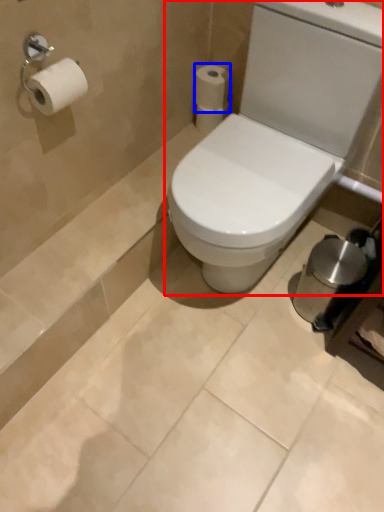
Question: Which object is further to the camera taking this photo, toilet (highlighted by a red box) or toilet paper (highlighted by a blue box)?

Choices:
 (A) toilet
 (B) toilet paper

Answer: (B)